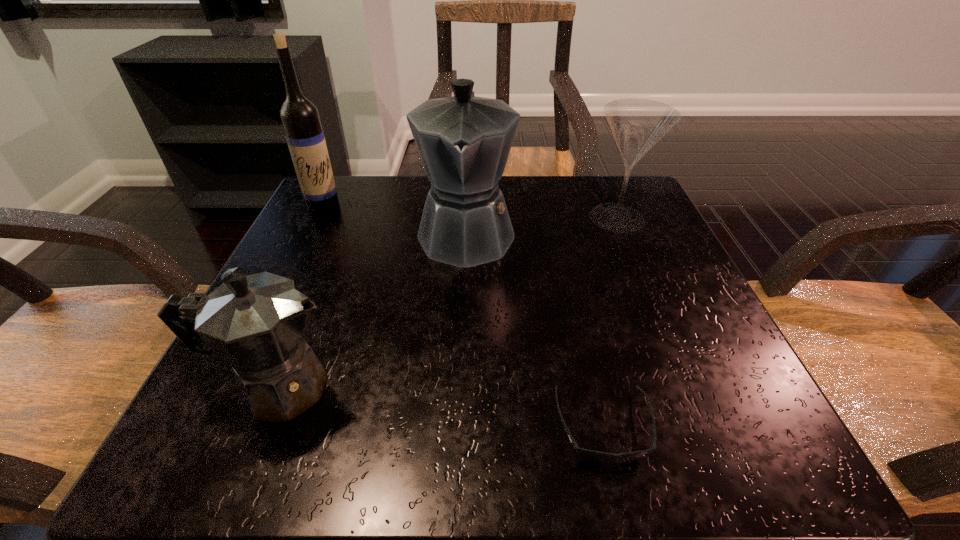
The width and height of the screenshot is (960, 540). I want to click on sunglasses at the right edge, so click(x=595, y=456).

Locate an element on the screen. object positioned at the far left corner is located at coordinates (300, 118).

The height and width of the screenshot is (540, 960). What are the coordinates of `object situated at the near left corner` in the screenshot? It's located at (255, 324).

You are a GUI agent. You are given a task and a screenshot of the screen. Output one action in this format:
    pyautogui.click(x=<x>, y=<y>)
    Task: Click on the object located in the far right corner section of the desktop
    This screenshot has width=960, height=540.
    Given the screenshot: What is the action you would take?
    pyautogui.click(x=637, y=125)

Where is `object at the near right corner`? The height and width of the screenshot is (540, 960). object at the near right corner is located at coordinates (595, 456).

In the image, there is a desktop. At what (x,y) coordinates should I click in order to perform the action: click on vacant space at the far edge. Please return your answer as a coordinate pair (x, y). This screenshot has height=540, width=960. Looking at the image, I should click on (525, 176).

The width and height of the screenshot is (960, 540). In the image, there is a desktop. What are the coordinates of `vacant space at the near edge` in the screenshot? It's located at (395, 455).

This screenshot has height=540, width=960. Identify the location of vacant space at the left edge of the desktop. (346, 244).

You are a GUI agent. You are given a task and a screenshot of the screen. Output one action in this format:
    pyautogui.click(x=<x>, y=<y>)
    Task: Click on the free space at the right edge of the desktop
    This screenshot has width=960, height=540.
    Given the screenshot: What is the action you would take?
    pyautogui.click(x=602, y=275)

At what (x,y) coordinates should I click in order to perform the action: click on vacant area at the far left corner. Please return your answer as a coordinate pair (x, y). The image size is (960, 540). Looking at the image, I should click on (369, 211).